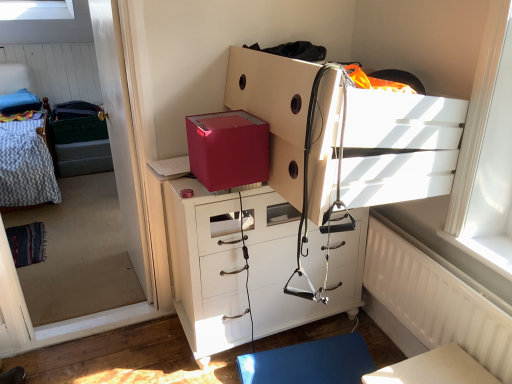
The image size is (512, 384). Identify the location of blue rubber yoga mat at lower center. (309, 362).

The width and height of the screenshot is (512, 384). What are the coordinates of `blue rubber yoga mat at lower center` in the screenshot? It's located at (309, 362).

Is white glossy chest of drawers at center, positioned as the second chest of drawers in top-to-bottom order, surrounded by white glossy table at lower right?

No, white glossy chest of drawers at center, positioned as the second chest of drawers in top-to-bottom order, is not inside white glossy table at lower right.

How many degrees apart are the facing directions of white glossy table at lower right and white glossy chest of drawers at center, placed as the first chest of drawers when sorted from bottom to top?

The angle between the facing direction of white glossy table at lower right and the facing direction of white glossy chest of drawers at center, placed as the first chest of drawers when sorted from bottom to top, is 91.1 degrees.

Considering the positions of objects white glossy table at lower right and white glossy chest of drawers at center, placed as the first chest of drawers when sorted from bottom to top, in the image provided, who is in front, white glossy table at lower right or white glossy chest of drawers at center, placed as the first chest of drawers when sorted from bottom to top,?

white glossy table at lower right is in front.

Identify the location of table that is in front of the white glossy chest of drawers at center, positioned as the second chest of drawers in top-to-bottom order. The image size is (512, 384). (434, 369).

Is textured fabric hospital bed at left with blue rubber yoga mat at lower center?

No, textured fabric hospital bed at left is not in contact with blue rubber yoga mat at lower center.

From the image's perspective, is textured fabric hospital bed at left below blue rubber yoga mat at lower center?

No.

In the image, is textured fabric hospital bed at left positioned in front of or behind blue rubber yoga mat at lower center?

Visually, textured fabric hospital bed at left is located behind blue rubber yoga mat at lower center.

Locate an element on the screen. yoga mat in front of the textured fabric hospital bed at left is located at coordinates (309, 362).

In the scene shown: Is matte white chest of drawers at center, positioned as the first chest of drawers in top-to-bottom order, completely or partially inside blue rubber yoga mat at lower center?

That's incorrect, matte white chest of drawers at center, positioned as the first chest of drawers in top-to-bottom order, is not inside blue rubber yoga mat at lower center.

Can you confirm if blue rubber yoga mat at lower center is wider than matte white chest of drawers at center, which is the 2th chest of drawers from bottom to top?

No, blue rubber yoga mat at lower center is not wider than matte white chest of drawers at center, which is the 2th chest of drawers from bottom to top.

From a real-world perspective, is blue rubber yoga mat at lower center on top of matte white chest of drawers at center, positioned as the first chest of drawers in top-to-bottom order?

Incorrect, from a real-world perspective, blue rubber yoga mat at lower center is lower than matte white chest of drawers at center, positioned as the first chest of drawers in top-to-bottom order.

Which object is positioned more to the left, white glossy table at lower right or blue rubber yoga mat at lower center?

blue rubber yoga mat at lower center.

Which is closer to the camera, (434, 364) or (300, 361)?

Point (434, 364) is positioned closer to the camera compared to point (300, 361).

Looking at this image, from the image's perspective, is white glossy table at lower right located above blue rubber yoga mat at lower center?

Yes.

From their relative heights in the image, would you say white glossy table at lower right is taller or shorter than blue rubber yoga mat at lower center?

Clearly, white glossy table at lower right is taller compared to blue rubber yoga mat at lower center.

Considering the sizes of objects matte red shoe box at center and matte white chest of drawers at center, which is the 2th chest of drawers from bottom to top, in the image provided, who is shorter, matte red shoe box at center or matte white chest of drawers at center, which is the 2th chest of drawers from bottom to top,?

Standing shorter between the two is matte white chest of drawers at center, which is the 2th chest of drawers from bottom to top.

At what (x,y) coordinates should I click in order to perform the action: click on chest of drawers above the matte red shoe box at center (from the image's perspective). Please return your answer as a coordinate pair (x, y). Looking at the image, I should click on (399, 146).

Is matte red shoe box at center at the left side of matte white chest of drawers at center, positioned as the first chest of drawers in top-to-bottom order?

Yes, matte red shoe box at center is to the left of matte white chest of drawers at center, positioned as the first chest of drawers in top-to-bottom order.

Does white glossy table at lower right have a greater width compared to transparent glass window screen at left?

Yes, white glossy table at lower right is wider than transparent glass window screen at left.

Based on the photo, is white glossy table at lower right positioned far away from transparent glass window screen at left?

Yes.

Which of these two, white glossy table at lower right or transparent glass window screen at left, stands shorter?

white glossy table at lower right.

Considering the relative positions of white glossy table at lower right and transparent glass window screen at left in the image provided, is white glossy table at lower right to the left of transparent glass window screen at left from the viewer's perspective?

No.

Considering the points (343, 372) and (228, 164), which point is behind, point (343, 372) or point (228, 164)?

The point (343, 372) is farther.

Is blue rubber yoga mat at lower center in contact with matte red shoe box at center?

blue rubber yoga mat at lower center and matte red shoe box at center are not in contact.

Locate an element on the screen. This screenshot has width=512, height=384. yoga mat that is under the matte red shoe box at center (from a real-world perspective) is located at coordinates (309, 362).

This screenshot has width=512, height=384. I want to click on the chest of drawers that is the 1st one when counting upward from the white glossy table at lower right (from the image's perspective), so click(206, 267).

I want to click on yoga mat below the textured fabric hospital bed at left (from the image's perspective), so click(309, 362).

Considering their positions, is transparent glass window screen at left positioned closer to white textured radiator at lower right than blue rubber yoga mat at lower center?

blue rubber yoga mat at lower center lies closer to white textured radiator at lower right than the other object.

When comparing their distances from white glossy table at lower right, does textured fabric hospital bed at left or white glossy chest of drawers at center, placed as the first chest of drawers when sorted from bottom to top, seem further?

textured fabric hospital bed at left lies further to white glossy table at lower right than the other object.

From the image, which object appears to be nearer to textured fabric hospital bed at left, blue rubber yoga mat at lower center or matte red shoe box at center?

matte red shoe box at center is positioned closer to the anchor textured fabric hospital bed at left.

Consider the image. When comparing their distances from textured fabric hospital bed at left, does matte red shoe box at center or matte white chest of drawers at center, which is the 2th chest of drawers from bottom to top, seem further?

matte white chest of drawers at center, which is the 2th chest of drawers from bottom to top, is positioned further to the anchor textured fabric hospital bed at left.

Based on their spatial positions, is textured fabric hospital bed at left or blue rubber yoga mat at lower center further from white glossy table at lower right?

textured fabric hospital bed at left lies further to white glossy table at lower right than the other object.

Estimate the real-world distances between objects in this image. Which object is further from white glossy chest of drawers at center, positioned as the second chest of drawers in top-to-bottom order, transparent glass window screen at left or white textured radiator at lower right?

transparent glass window screen at left lies further to white glossy chest of drawers at center, positioned as the second chest of drawers in top-to-bottom order, than the other object.

Estimate the real-world distances between objects in this image. Which object is closer to white glossy chest of drawers at center, placed as the first chest of drawers when sorted from bottom to top, matte white chest of drawers at center, which is the 2th chest of drawers from bottom to top, or blue rubber yoga mat at lower center?

The object closer to white glossy chest of drawers at center, placed as the first chest of drawers when sorted from bottom to top, is blue rubber yoga mat at lower center.

Looking at this image, looking at the image, which one is located further to blue rubber yoga mat at lower center, matte red shoe box at center or white textured radiator at lower right?

matte red shoe box at center is positioned further to the anchor blue rubber yoga mat at lower center.

The image size is (512, 384). I want to click on window screen between textured fabric hospital bed at left and white textured radiator at lower right from left to right, so click(96, 220).

You are a GUI agent. You are given a task and a screenshot of the screen. Output one action in this format:
    pyautogui.click(x=<x>, y=<y>)
    Task: Click on the shoe box between matte white chest of drawers at center, which is the 2th chest of drawers from bottom to top, and blue rubber yoga mat at lower center vertically
    The width and height of the screenshot is (512, 384).
    Given the screenshot: What is the action you would take?
    pyautogui.click(x=228, y=149)

Where is `shoe box between transparent glass window screen at left and blue rubber yoga mat at lower center`? The width and height of the screenshot is (512, 384). shoe box between transparent glass window screen at left and blue rubber yoga mat at lower center is located at coordinates (228, 149).

Image resolution: width=512 pixels, height=384 pixels. I want to click on radiator that lies between matte red shoe box at center and blue rubber yoga mat at lower center from top to bottom, so click(430, 301).